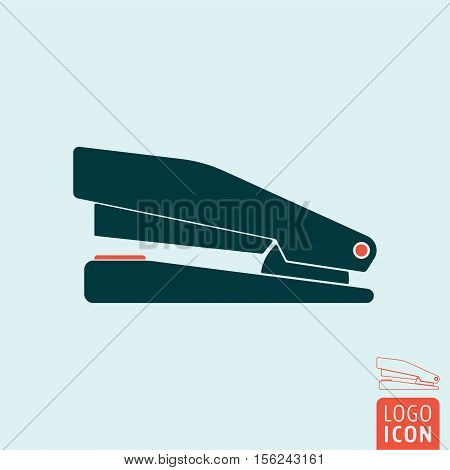
This screenshot has width=450, height=470. Find the location of `stapler`. stapler is located at coordinates (397, 364), (233, 287).